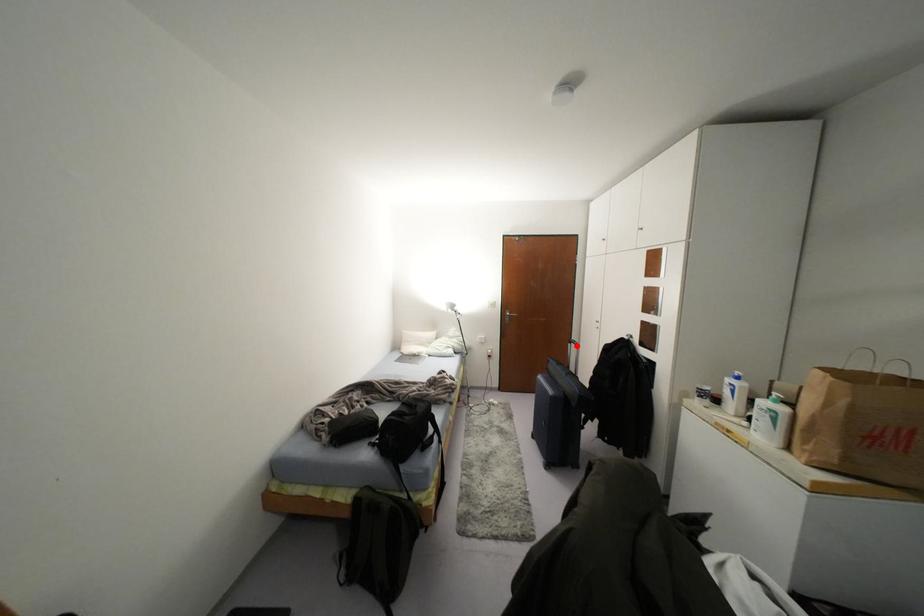
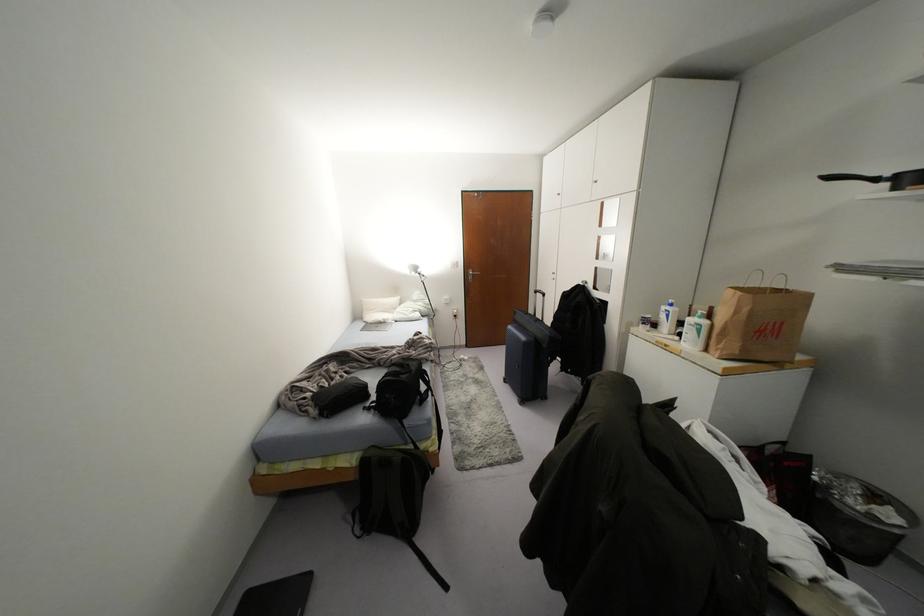
Find the pixel in the second image that matches the highlighted location in the first image.

(542, 294)